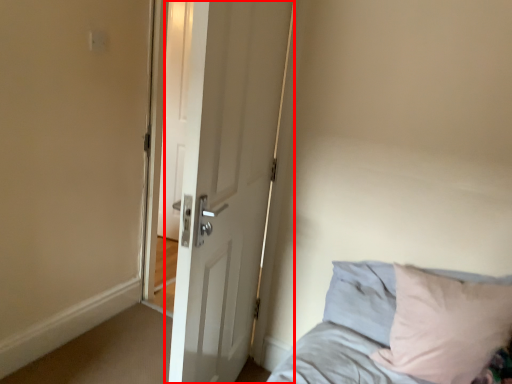
Question: Observing the image, what is the correct spatial positioning of door (annotated by the red box) in reference to bed?

Choices:
 (A) left
 (B) right

Answer: (A)